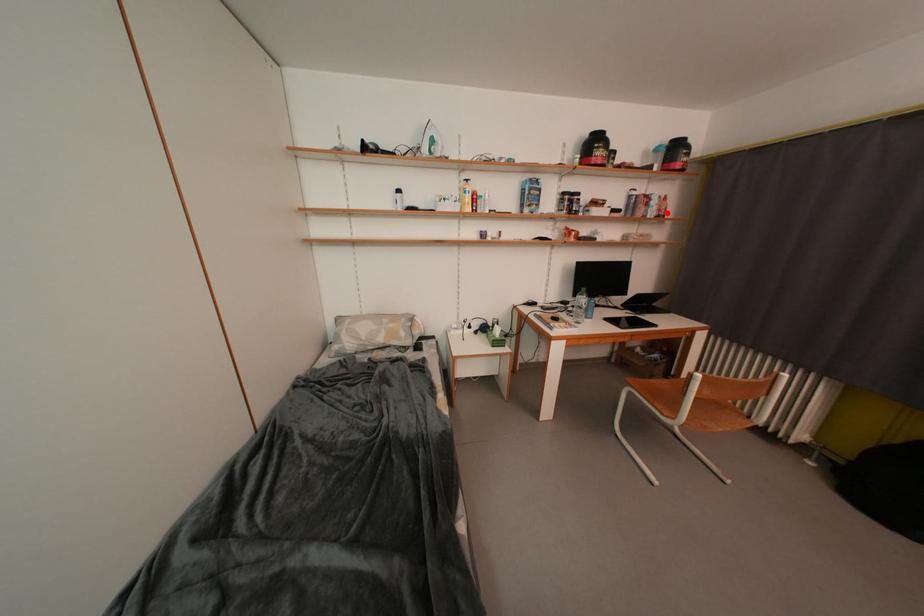
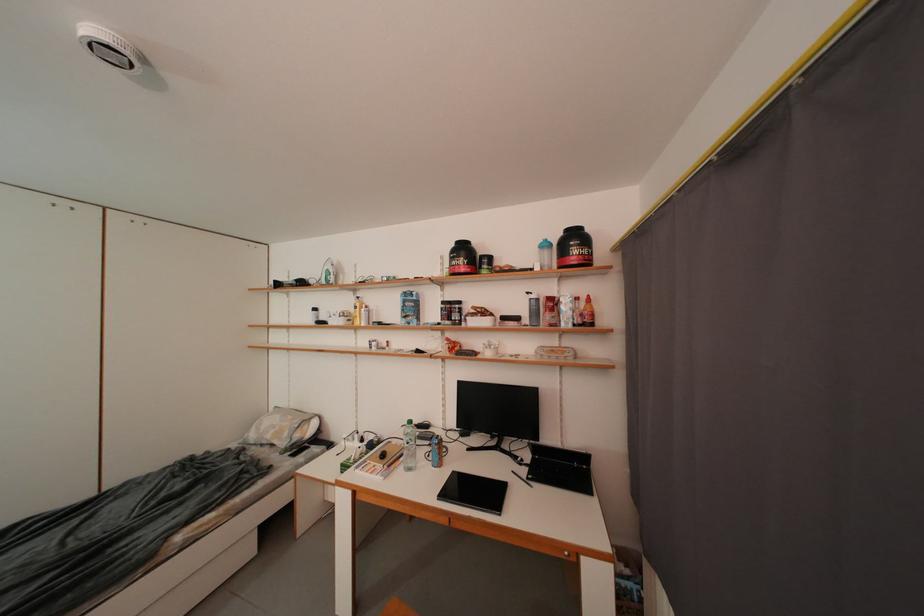
Question: I am providing you with two images of the same scene from different viewpoints. A red point is shown in image1. For the corresponding object point in image2, is it positioned nearer or farther from the camera?

Choices:
 (A) Nearer
 (B) Farther

Answer: (B)